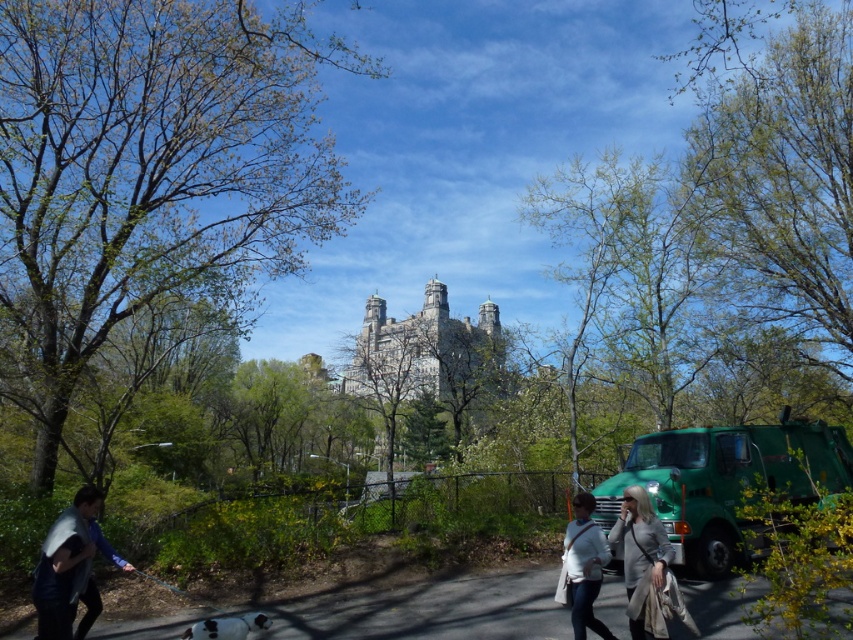
You are a park visitor holding a white fabric bag at lower center. You want to place it under the green leafy tree at upper center for shade. Will the tree provide enough shade to cover your bag?

The green leafy tree at upper center is larger than the white fabric bag at lower center, so it should provide sufficient shade to cover the bag.

Based on the photo, you are a park visitor who wants to take a photo of both the green leafy tree at upper center and the green leafy tree at upper right in the background of the historic building. Given that your camera can capture a maximum distance of 70 meters between two objects in focus, will you be able to have both trees in focus in the same photo?

The distance between the green leafy tree at upper center and the green leafy tree at upper right is 72.40 meters, which exceeds the camera maximum focus distance of 70 meters. Therefore, both trees cannot be in focus simultaneously in the same photo.